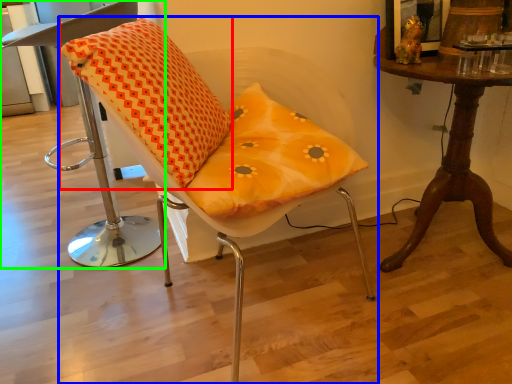
Question: Based on their relative distances, which object is nearer to throw pillow (highlighted by a red box)? Choose from chair (highlighted by a blue box) and chair (highlighted by a green box).

Choices:
 (A) chair
 (B) chair

Answer: (A)